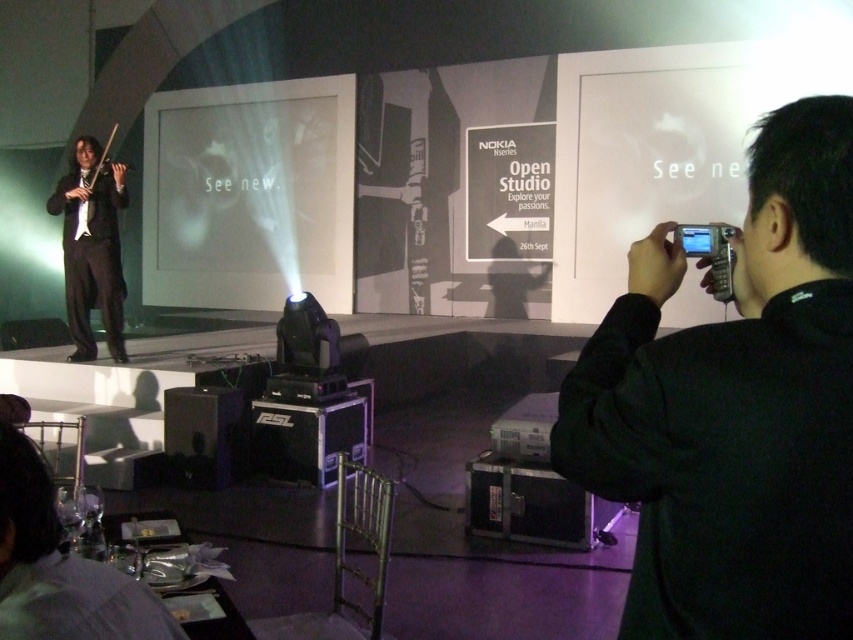
Question: Estimate the real-world distances between objects in this image. Which object is farther from the black plastic speaker at lower center?

Choices:
 (A) white matte projection screen at center
 (B) black fabric camera at right

Answer: (A)

Question: Does white matte projection screen at center appear under black plastic speaker at lower center?

Choices:
 (A) no
 (B) yes

Answer: (A)

Question: Among these objects, which one is farthest from the camera?

Choices:
 (A) black fabric camera at right
 (B) matte black suit at left
 (C) black plastic speaker at lower center
 (D) white matte projection screen at center

Answer: (D)

Question: Does white matte projection screen at center have a smaller size compared to black plastic speaker at lower center?

Choices:
 (A) no
 (B) yes

Answer: (A)

Question: Which of the following is the farthest from the observer?

Choices:
 (A) (820, 422)
 (B) (170, 115)
 (C) (73, 163)

Answer: (B)

Question: Can you confirm if black fabric camera at right is wider than white matte projection screen at center?

Choices:
 (A) yes
 (B) no

Answer: (B)